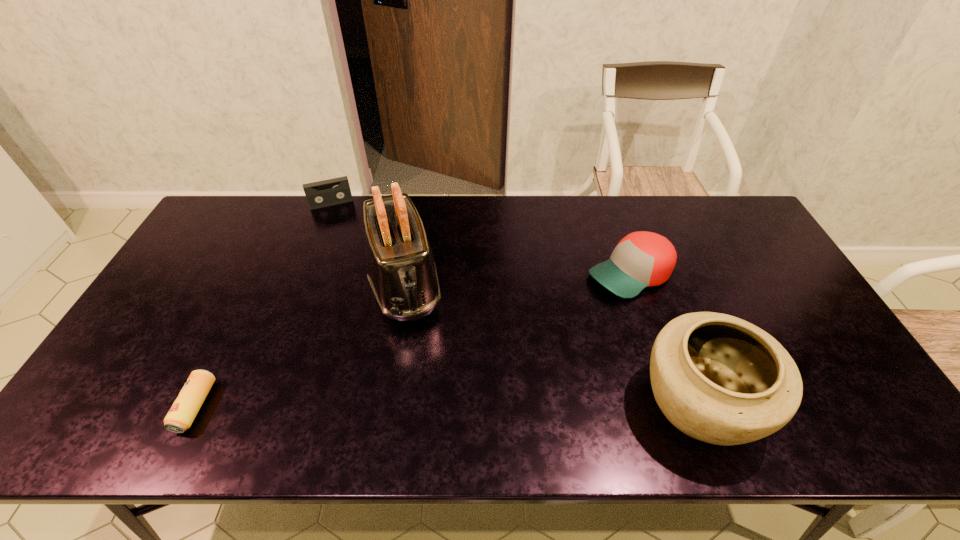
Identify the location of beer can. The image size is (960, 540). (x=181, y=415).

You are a GUI agent. You are given a task and a screenshot of the screen. Output one action in this format:
    pyautogui.click(x=<x>, y=<y>)
    Task: Click on the shortest object
    The height and width of the screenshot is (540, 960).
    Given the screenshot: What is the action you would take?
    pyautogui.click(x=181, y=415)

You are a GUI agent. You are given a task and a screenshot of the screen. Output one action in this format:
    pyautogui.click(x=<x>, y=<y>)
    Task: Click on the pottery
    Image resolution: width=960 pixels, height=540 pixels.
    Given the screenshot: What is the action you would take?
    pyautogui.click(x=717, y=378)

The image size is (960, 540). I want to click on the fourth tallest object, so click(x=319, y=194).

Find the location of a particular element. This screenshot has width=960, height=540. the farthest object is located at coordinates (319, 194).

At what (x,y) coordinates should I click in order to perform the action: click on toaster. Please return your answer as a coordinate pair (x, y). This screenshot has width=960, height=540. Looking at the image, I should click on (401, 270).

This screenshot has width=960, height=540. Identify the location of the third object from right to left. pos(401,270).

The height and width of the screenshot is (540, 960). Find the location of `baseball cap`. baseball cap is located at coordinates (641, 259).

Image resolution: width=960 pixels, height=540 pixels. I want to click on free location located on the back of the beer can, so click(254, 285).

At what (x,y) coordinates should I click in order to perform the action: click on vacant position located on the back of the pottery. Please return your answer as a coordinate pair (x, y). The width and height of the screenshot is (960, 540). Looking at the image, I should click on (659, 295).